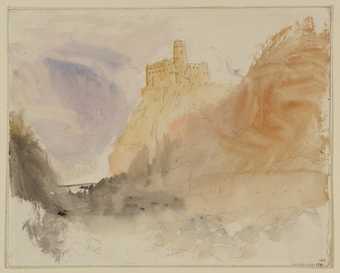
What are the coordinates of `square frame` in the screenshot? It's located at (170, 2).